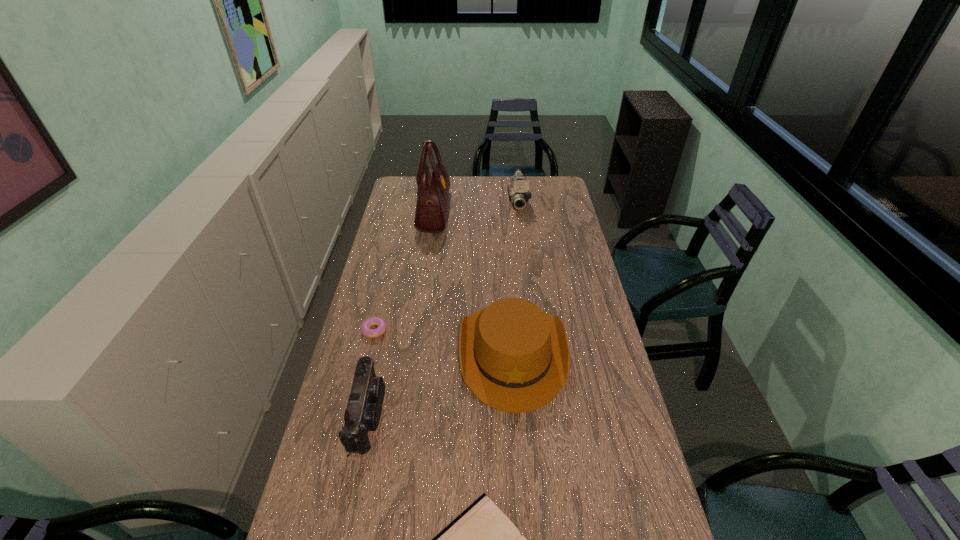
Locate an element on the screen. The width and height of the screenshot is (960, 540). vacant space situated 0.280m on the front-facing side of the shorter camcorder is located at coordinates (478, 415).

The height and width of the screenshot is (540, 960). Find the location of `free region located on the right of the doughnut`. free region located on the right of the doughnut is located at coordinates (471, 330).

Image resolution: width=960 pixels, height=540 pixels. I want to click on handbag that is at the far edge, so click(x=433, y=181).

The image size is (960, 540). I want to click on camcorder that is at the far edge, so click(x=518, y=192).

Identify the location of handbag that is at the left edge. (433, 181).

Find the location of `camcorder present at the left edge`. camcorder present at the left edge is located at coordinates (364, 405).

The image size is (960, 540). I want to click on doughnut that is at the left edge, so click(x=371, y=333).

Find the location of a particular element. The height and width of the screenshot is (540, 960). object located at the right edge is located at coordinates (515, 358).

Locate an element on the screen. The width and height of the screenshot is (960, 540). object located in the far left corner section of the desktop is located at coordinates point(433,181).

Locate an element on the screen. vacant region at the far edge of the desktop is located at coordinates pyautogui.click(x=481, y=197).